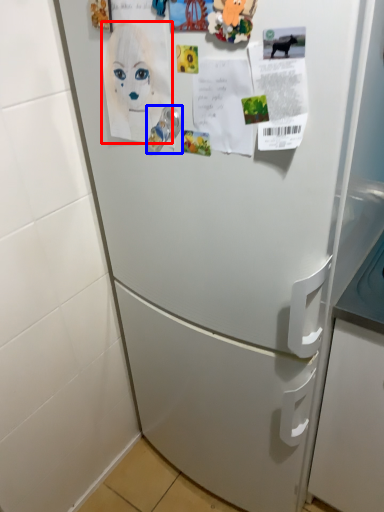
Question: Which object appears farthest to the camera in this image, woman (highlighted by a red box) or door handle (highlighted by a blue box)?

Choices:
 (A) woman
 (B) door handle

Answer: (B)